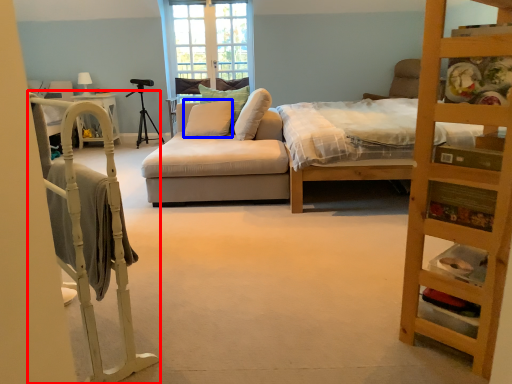
Question: Which object appears closest to the camera in this image, bunk bed (highlighted by a red box) or pillow (highlighted by a blue box)?

Choices:
 (A) bunk bed
 (B) pillow

Answer: (A)